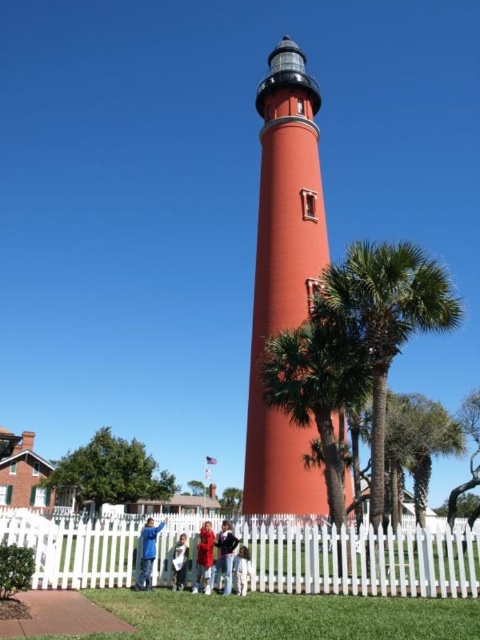
Question: Can you confirm if white picket fence at lower center is positioned to the left of blue denim jacket at lower center?

Choices:
 (A) no
 (B) yes

Answer: (A)

Question: Considering the relative positions of smooth orange lighthouse at center and blue denim jacket at lower center in the image provided, where is smooth orange lighthouse at center located with respect to blue denim jacket at lower center?

Choices:
 (A) left
 (B) right

Answer: (B)

Question: Which of the following is the farthest from the observer?

Choices:
 (A) blue denim jacket at lower center
 (B) green leafy palm tree at center
 (C) smooth orange lighthouse at center
 (D) red velvet coat at center

Answer: (C)

Question: Is the position of green leafy palm tree at lower right less distant than that of red velvet coat at center?

Choices:
 (A) yes
 (B) no

Answer: (A)

Question: Which point is farther to the camera?

Choices:
 (A) green leafy palm tree at lower right
 (B) red velvet coat at lower center
 (C) white picket fence at lower center
 (D) red fabric coat at center

Answer: (B)

Question: Which object appears closest to the camera in this image?

Choices:
 (A) green leafy palm tree at lower right
 (B) white cotton pants at lower center
 (C) red fabric coat at center
 (D) smooth orange lighthouse at center

Answer: (A)